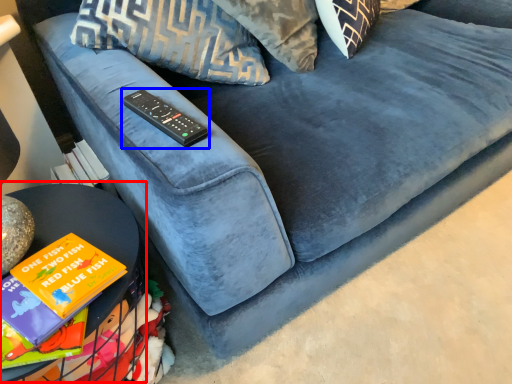
Question: Which object is further to the camera taking this photo, table (highlighted by a red box) or remote (highlighted by a blue box)?

Choices:
 (A) table
 (B) remote

Answer: (B)